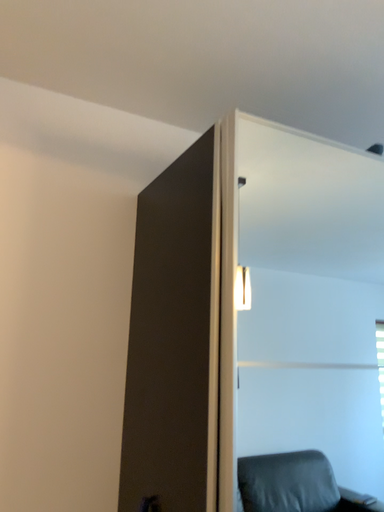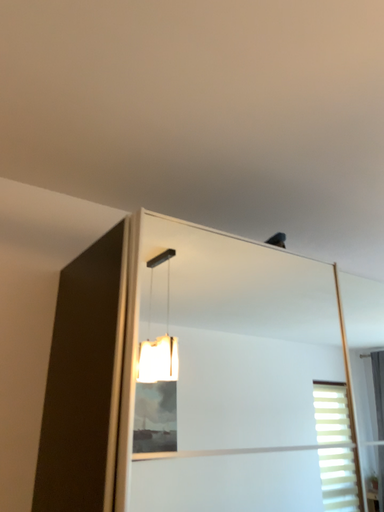
Question: Which way did the camera rotate in the video?

Choices:
 (A) rotated upward
 (B) rotated downward

Answer: (A)